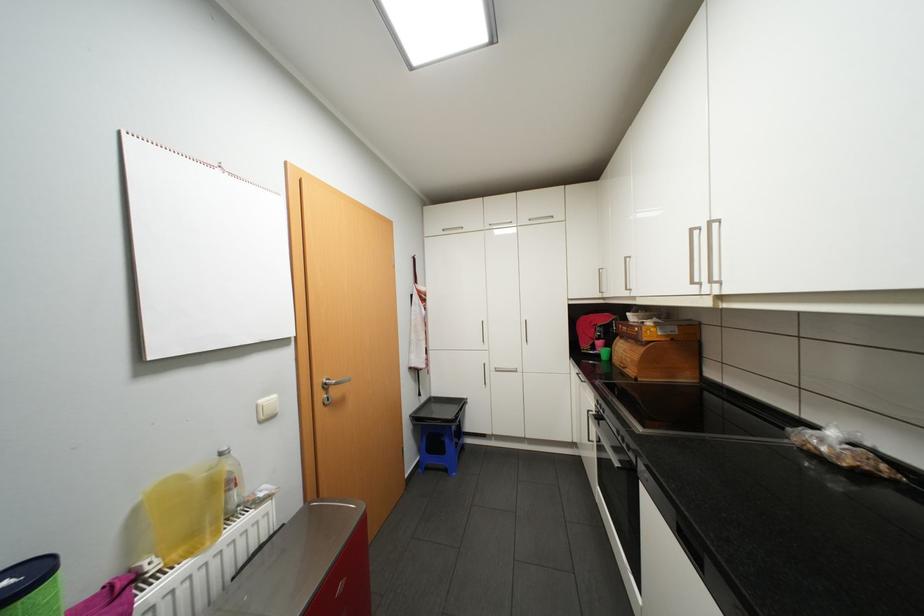
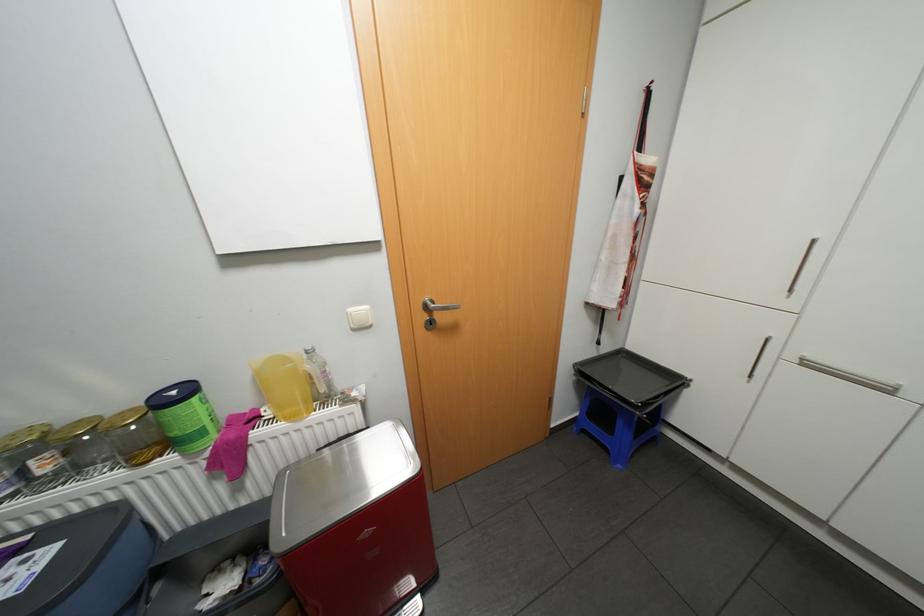
How did the camera likely rotate?

The rotation direction of the camera is left-down.